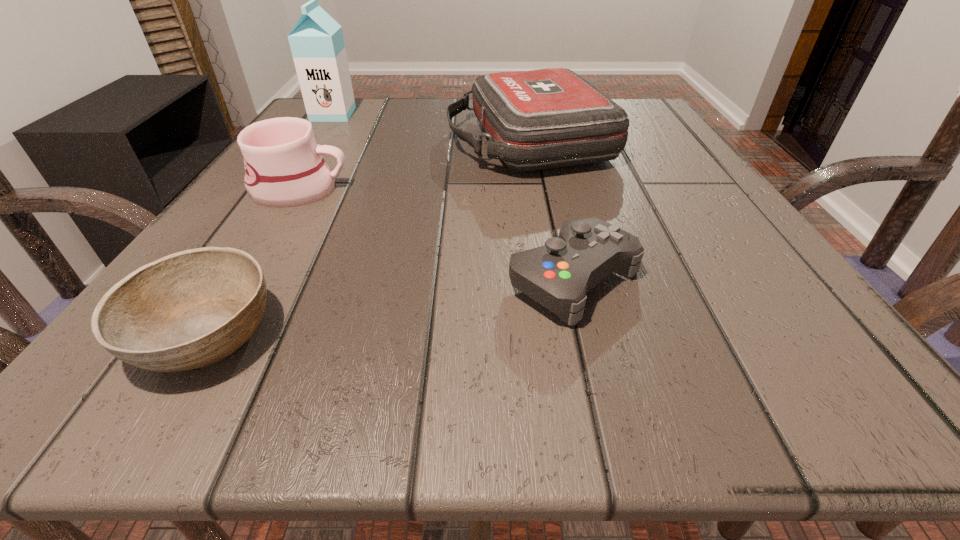
The width and height of the screenshot is (960, 540). In order to click on milk carton present at the far edge in this screenshot , I will do `click(316, 41)`.

You are a GUI agent. You are given a task and a screenshot of the screen. Output one action in this format:
    pyautogui.click(x=<x>, y=<y>)
    Task: Click on the first-aid kit located at the far edge
    
    Given the screenshot: What is the action you would take?
    pyautogui.click(x=547, y=118)

Image resolution: width=960 pixels, height=540 pixels. In order to click on object situated at the near edge in this screenshot , I will do `click(191, 309)`.

Where is `milk carton that is at the left edge`? The image size is (960, 540). milk carton that is at the left edge is located at coordinates (x=316, y=41).

The width and height of the screenshot is (960, 540). I want to click on mug that is at the left edge, so click(x=284, y=167).

This screenshot has height=540, width=960. Identify the location of bowl that is at the left edge. (191, 309).

Locate an element on the screen. object present at the right edge is located at coordinates pyautogui.click(x=547, y=118).

This screenshot has height=540, width=960. What are the coordinates of `object at the far left corner` in the screenshot? It's located at (316, 41).

Locate an element on the screen. The height and width of the screenshot is (540, 960). object positioned at the near left corner is located at coordinates (191, 309).

What are the coordinates of `object situated at the far right corner` in the screenshot? It's located at (547, 118).